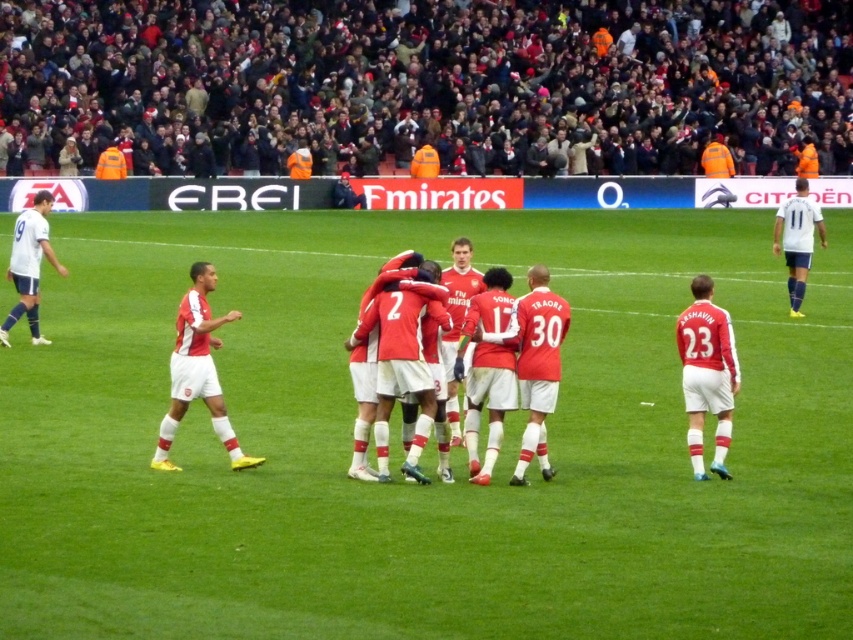
Question: Which of the following is the closest to the observer?

Choices:
 (A) (793, 260)
 (B) (728, 326)
 (C) (383, 280)
 (D) (305, 472)

Answer: (C)

Question: In this image, where is white matte jersey at left located relative to white smooth soccer player at right?

Choices:
 (A) left
 (B) right

Answer: (A)

Question: Is dark gray fabric crowd at upper center above white smooth soccer player at right?

Choices:
 (A) yes
 (B) no

Answer: (A)

Question: Does matte red jersey at right have a smaller size compared to white matte jersey at left?

Choices:
 (A) no
 (B) yes

Answer: (A)

Question: Which object is positioned closest to the white matte jersey at left?

Choices:
 (A) white smooth soccer player at right
 (B) green grass football field at center

Answer: (B)

Question: Which of the following is the closest to the observer?

Choices:
 (A) green grass football field at center
 (B) matte white shorts at left
 (C) white matte jersey at left

Answer: (A)